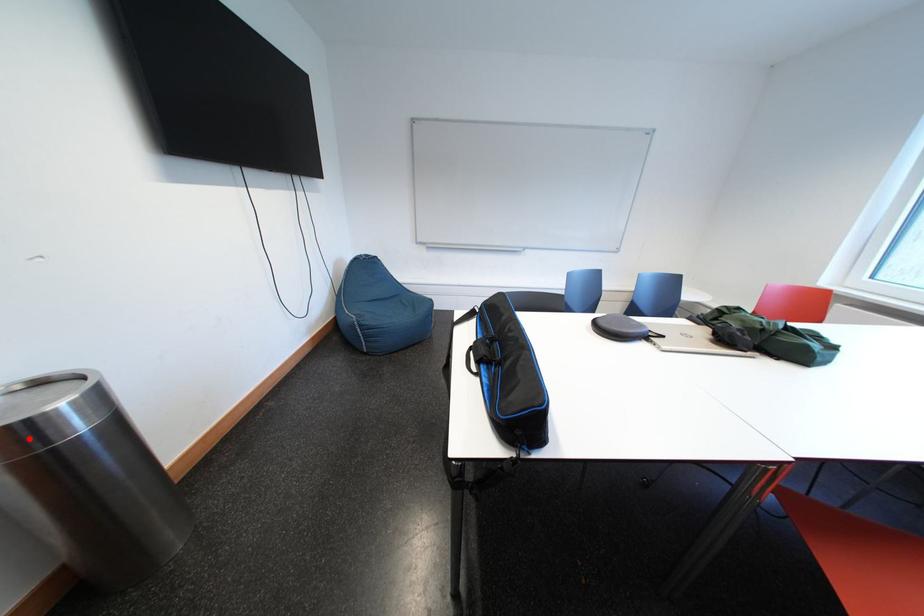
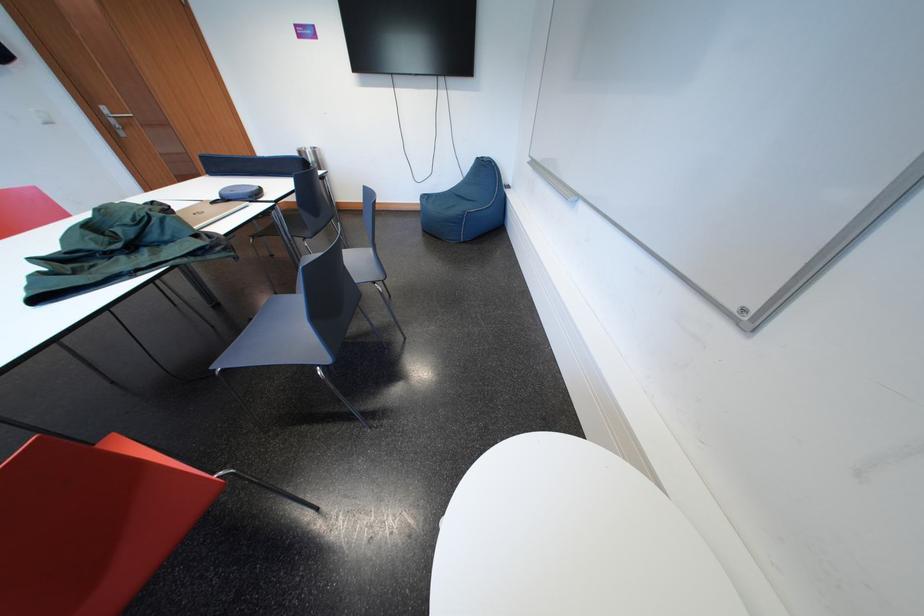
Question: A red point is marked in image1. In image2, is the corresponding 3D point closer to the camera or farther? Reply with the corresponding letter.

Choices:
 (A) The corresponding 3D point is closer.
 (B) The corresponding 3D point is farther.

Answer: (B)